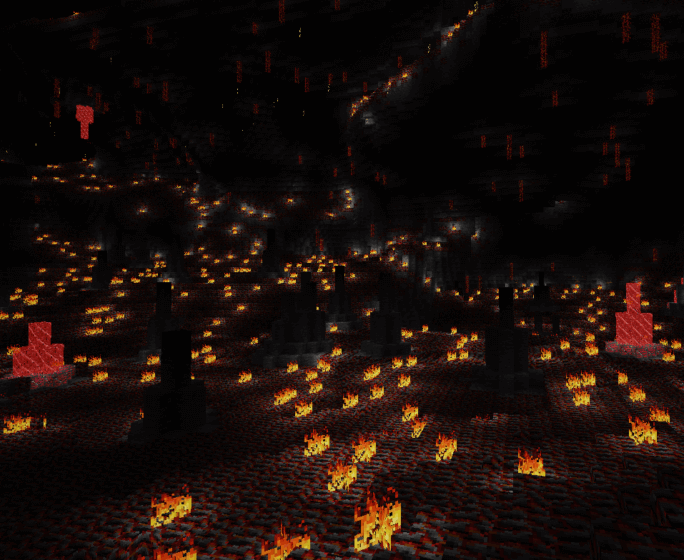
At what (x,y) coordinates should I click in order to perform the action: click on back wall. Please return your answer as a coordinate pair (x, y). Image resolution: width=684 pixels, height=560 pixels. Looking at the image, I should click on (495, 88).